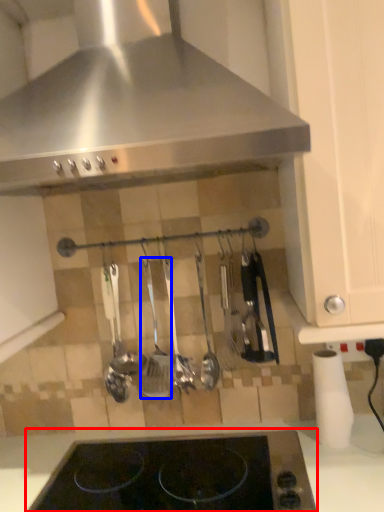
Question: Which point is further to the camera, gas stove (highlighted by a red box) or silverware (highlighted by a blue box)?

Choices:
 (A) gas stove
 (B) silverware

Answer: (B)